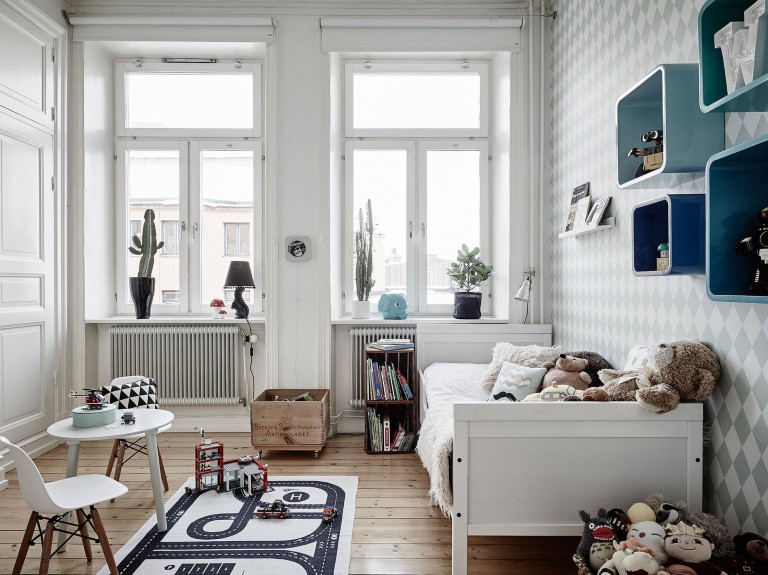
I want to click on lamps, so tap(525, 298), tap(249, 288).